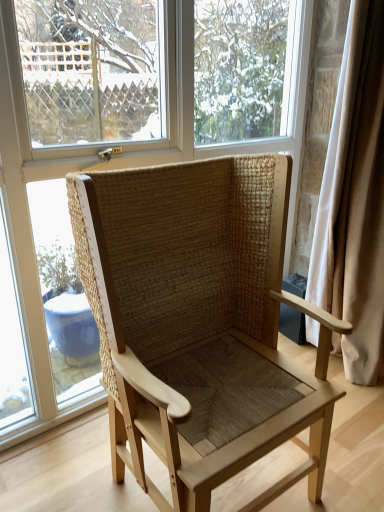
At what (x,y) coordinates should I click in order to perform the action: click on white fabric curtain at right. Please return your answer as a coordinate pair (x, y). Looking at the image, I should click on (355, 201).

The width and height of the screenshot is (384, 512). I want to click on natural woven wood chair at center, so click(199, 323).

Considering the positions of point (178, 305) and point (378, 228), is point (178, 305) closer or farther from the camera than point (378, 228)?

Point (178, 305) is closer to the camera than point (378, 228).

Considering the relative sizes of natural woven wood chair at center and white fabric curtain at right in the image provided, is natural woven wood chair at center thinner than white fabric curtain at right?

No, natural woven wood chair at center is not thinner than white fabric curtain at right.

Is natural woven wood chair at center taller than white fabric curtain at right?

No, natural woven wood chair at center is not taller than white fabric curtain at right.

From a real-world perspective, between natural woven wood chair at center and white fabric curtain at right, who is vertically lower?

From a 3D spatial view, natural woven wood chair at center is below.

Is transparent glass window at center not near white fabric curtain at right?

No, there isn't a large distance between transparent glass window at center and white fabric curtain at right.

Visually, is transparent glass window at center positioned to the left or to the right of white fabric curtain at right?

transparent glass window at center is to the left of white fabric curtain at right.

Is transparent glass window at center aimed at white fabric curtain at right?

Yes.

From a real-world perspective, which is physically below, transparent glass window at center or white fabric curtain at right?

white fabric curtain at right, from a real-world perspective.

Between transparent glass window at center and natural woven wood chair at center, which one appears on the right side from the viewer's perspective?

natural woven wood chair at center.

How much distance is there between transparent glass window at center and natural woven wood chair at center?

transparent glass window at center is 49.43 centimeters from natural woven wood chair at center.

Is transparent glass window at center wider than natural woven wood chair at center?

Incorrect, the width of transparent glass window at center does not surpass that of natural woven wood chair at center.

In the scene shown: Is transparent glass window at center facing towards natural woven wood chair at center?

Yes, transparent glass window at center is facing natural woven wood chair at center.

Is natural woven wood chair at center touching transparent glass window at center?

No.

Does natural woven wood chair at center appear on the right side of transparent glass window at center?

Yes.

Is point (270, 245) closer or farther from the camera than point (22, 297)?

Point (270, 245) is closer to the camera than point (22, 297).

Between natural woven wood chair at center and transparent glass window at center, which one has larger width?

Wider between the two is natural woven wood chair at center.

Does white fabric curtain at right have a larger size compared to transparent glass window at center?

Incorrect, white fabric curtain at right is not larger than transparent glass window at center.

Does point (375, 265) come farther from viewer compared to point (29, 249)?

Yes, point (375, 265) is behind point (29, 249).

Considering the sizes of white fabric curtain at right and transparent glass window at center in the image, is white fabric curtain at right taller or shorter than transparent glass window at center?

Clearly, white fabric curtain at right is shorter compared to transparent glass window at center.

Which of these two, white fabric curtain at right or transparent glass window at center, is wider?

white fabric curtain at right is wider.

In the scene shown: From a real-world perspective, is white fabric curtain at right above or below natural woven wood chair at center?

In terms of real-world spatial position, white fabric curtain at right is above natural woven wood chair at center.

Find the location of a particular element. curtain on the right side of natural woven wood chair at center is located at coordinates (355, 201).

Relative to natural woven wood chair at center, is white fabric curtain at right in front or behind?

white fabric curtain at right is behind natural woven wood chair at center.

You are a GUI agent. You are given a task and a screenshot of the screen. Output one action in this format:
    pyautogui.click(x=<x>, y=<y>)
    Task: Click on the curtain on the right of natural woven wood chair at center
    The width and height of the screenshot is (384, 512).
    Given the screenshot: What is the action you would take?
    pyautogui.click(x=355, y=201)

The image size is (384, 512). Identify the location of window lying in front of the white fabric curtain at right. (31, 233).

Considering their positions, is natural woven wood chair at center positioned further to white fabric curtain at right than transparent glass window at center?

Based on the image, natural woven wood chair at center appears to be further to white fabric curtain at right.

Based on their spatial positions, is transparent glass window at center or natural woven wood chair at center further from white fabric curtain at right?

natural woven wood chair at center is positioned further to the anchor white fabric curtain at right.

Which object lies nearer to the anchor point natural woven wood chair at center, white fabric curtain at right or transparent glass window at center?

Based on the image, transparent glass window at center appears to be nearer to natural woven wood chair at center.

Which object lies further to the anchor point natural woven wood chair at center, transparent glass window at center or white fabric curtain at right?

The object further to natural woven wood chair at center is white fabric curtain at right.

When comparing their distances from transparent glass window at center, does natural woven wood chair at center or white fabric curtain at right seem further?

white fabric curtain at right lies further to transparent glass window at center than the other object.

Looking at the image, which one is located closer to transparent glass window at center, white fabric curtain at right or natural woven wood chair at center?

Based on the image, natural woven wood chair at center appears to be nearer to transparent glass window at center.

You are a GUI agent. You are given a task and a screenshot of the screen. Output one action in this format:
    pyautogui.click(x=<x>, y=<y>)
    Task: Click on the chair situated between transparent glass window at center and white fabric curtain at right from left to right
    The width and height of the screenshot is (384, 512).
    Given the screenshot: What is the action you would take?
    199,323